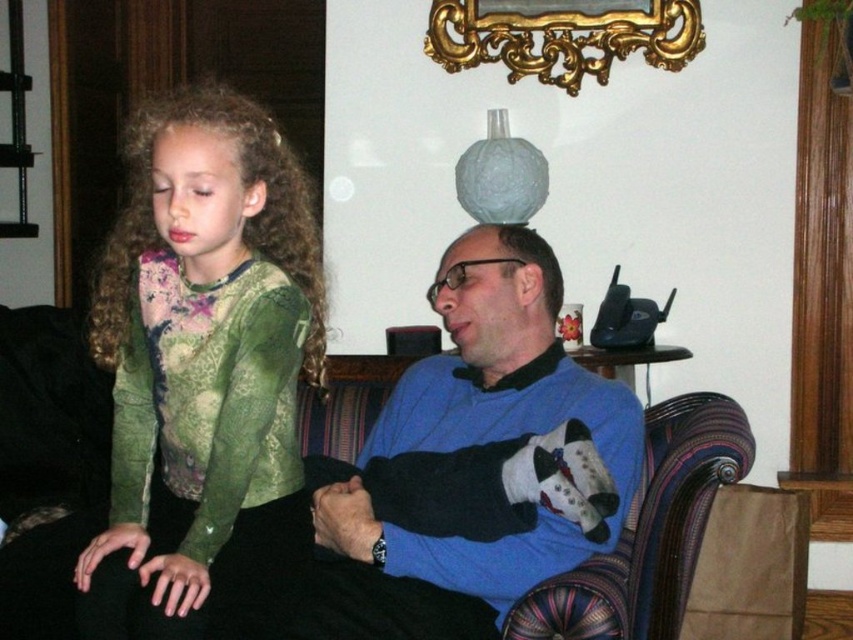
Question: Does blue soft sweater at center appear on the left side of gold ornate mirror at upper center?

Choices:
 (A) yes
 (B) no

Answer: (A)

Question: Which is farther from the green lace shirt at left?

Choices:
 (A) blue soft sweater at center
 (B) gold ornate mirror at upper center

Answer: (B)

Question: Which of these objects is positioned closest to the green lace shirt at left?

Choices:
 (A) gold ornate mirror at upper center
 (B) blue soft sweater at center

Answer: (B)

Question: In this image, where is green lace shirt at left located relative to gold ornate mirror at upper center?

Choices:
 (A) above
 (B) below

Answer: (B)

Question: Does blue soft sweater at center come behind gold ornate mirror at upper center?

Choices:
 (A) no
 (B) yes

Answer: (A)

Question: Which point is closer to the camera taking this photo?

Choices:
 (A) (595, 45)
 (B) (370, 524)

Answer: (B)